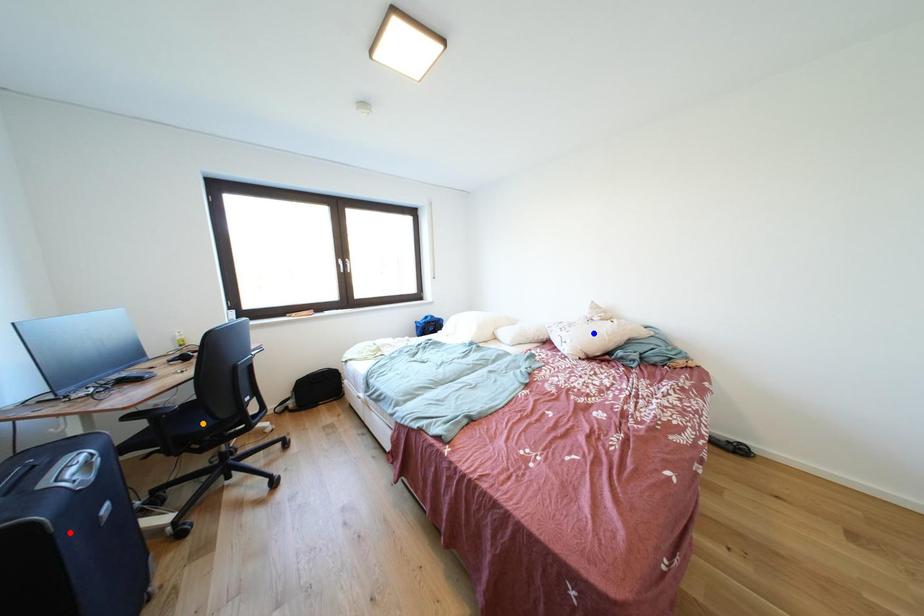
Order these from nearest to farthest:
A) orange point
B) blue point
C) red point

red point, orange point, blue point